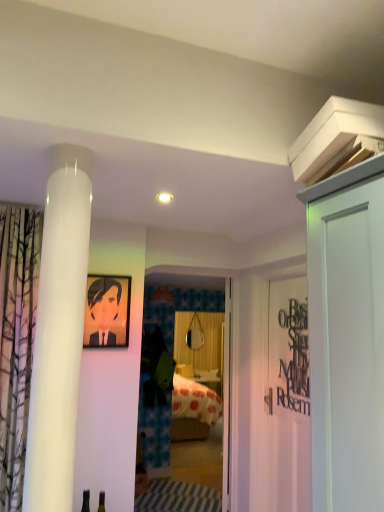
Question: Is matte black picture frame at upper left positioned before white matte door at upper right, placed as the 2th door when sorted from back to front?

Choices:
 (A) yes
 (B) no

Answer: (B)

Question: Is matte black picture frame at upper left thinner than white matte door at upper right, the first door when ordered from right to left?

Choices:
 (A) no
 (B) yes

Answer: (B)

Question: Is matte black picture frame at upper left looking in the opposite direction of white matte door at upper right, acting as the second door starting from the left?

Choices:
 (A) no
 (B) yes

Answer: (A)

Question: Does matte black picture frame at upper left touch white matte door at upper right, the first door when ordered from right to left?

Choices:
 (A) no
 (B) yes

Answer: (A)

Question: From the image's perspective, is matte black picture frame at upper left above white matte door at upper right, the first door when ordered from right to left?

Choices:
 (A) yes
 (B) no

Answer: (A)

Question: Do you think transparent glass door at center is within matte black picture frame at upper left, or outside of it?

Choices:
 (A) inside
 (B) outside

Answer: (B)

Question: From the image's perspective, is transparent glass door at center positioned above or below matte black picture frame at upper left?

Choices:
 (A) above
 (B) below

Answer: (B)

Question: Is point (198, 303) closer or farther from the camera than point (102, 280)?

Choices:
 (A) closer
 (B) farther

Answer: (B)

Question: In terms of height, does transparent glass door at center look taller or shorter compared to matte black picture frame at upper left?

Choices:
 (A) short
 (B) tall

Answer: (B)

Question: Looking at their shapes, would you say white matte door at upper right, which is counted as the first door, starting from the front, is wider or thinner than transparent glass door at center?

Choices:
 (A) wide
 (B) thin

Answer: (A)

Question: Is white matte door at upper right, which is counted as the first door, starting from the front, to the left or to the right of transparent glass door at center in the image?

Choices:
 (A) left
 (B) right

Answer: (B)

Question: Considering the positions of white matte door at upper right, which is counted as the first door, starting from the front, and transparent glass door at center in the image, is white matte door at upper right, which is counted as the first door, starting from the front, bigger or smaller than transparent glass door at center?

Choices:
 (A) small
 (B) big

Answer: (B)

Question: Is point (329, 215) closer or farther from the camera than point (153, 467)?

Choices:
 (A) closer
 (B) farther

Answer: (A)

Question: Does point (302, 403) appear closer or farther from the camera than point (185, 351)?

Choices:
 (A) closer
 (B) farther

Answer: (A)

Question: Relative to transparent glass door at center, is black matte sign at right in front or behind?

Choices:
 (A) behind
 (B) front

Answer: (B)